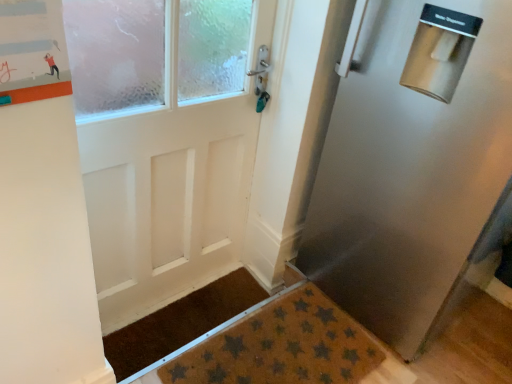
Question: Is brown textured doormat at lower center, which appears as the first doormat when viewed from the front, in front of or behind stainless steel refrigerator at right in the image?

Choices:
 (A) front
 (B) behind

Answer: (B)

Question: Based on their positions, is brown textured doormat at lower center, which appears as the second doormat when viewed from the back, located to the left or right of stainless steel refrigerator at right?

Choices:
 (A) right
 (B) left

Answer: (B)

Question: Estimate the real-world distances between objects in this image. Which object is farther from the brown textured doormat at lower center, which appears as the first doormat when viewed from the front?

Choices:
 (A) orange matte bulletin board at upper left
 (B) brown textured mat at lower center, which appears as the 1th doormat when viewed from the back
 (C) stainless steel refrigerator at right

Answer: (A)

Question: Which of these objects is positioned farthest from the orange matte bulletin board at upper left?

Choices:
 (A) brown textured doormat at lower center, which appears as the first doormat when viewed from the front
 (B) brown textured mat at lower center, acting as the 2th doormat starting from the front
 (C) stainless steel refrigerator at right

Answer: (B)